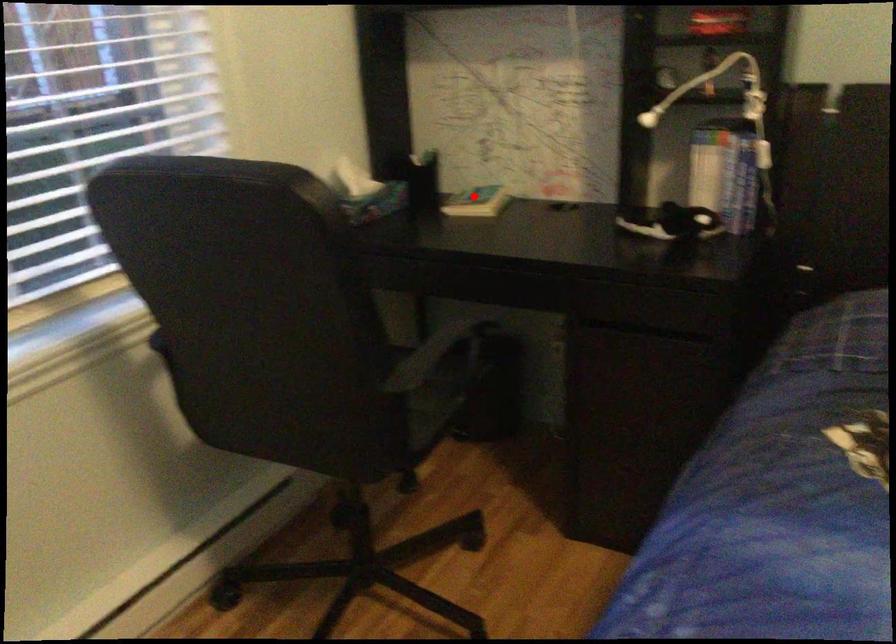
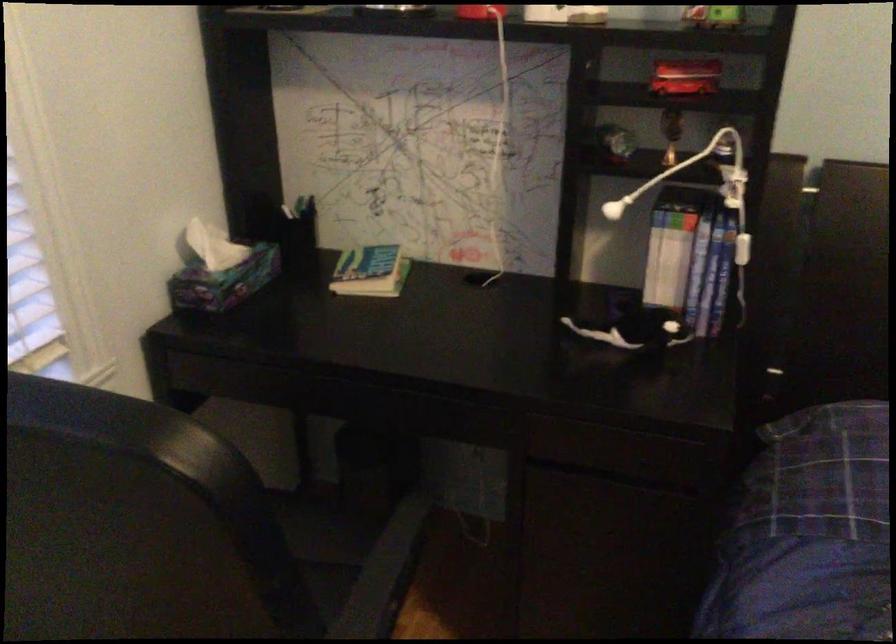
Locate, in the second image, the point that corresponds to the highlighted location in the first image.

(371, 270)